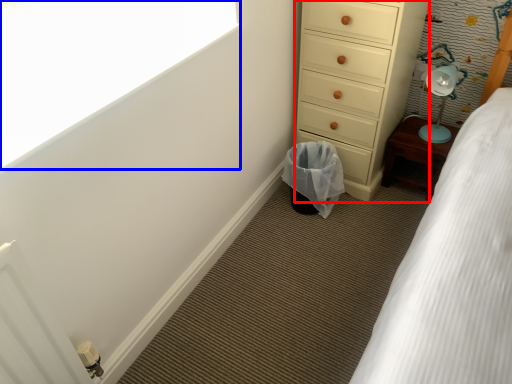
Question: Which point is closer to the camera, chest of drawers (highlighted by a red box) or window screen (highlighted by a blue box)?

Choices:
 (A) chest of drawers
 (B) window screen

Answer: (B)